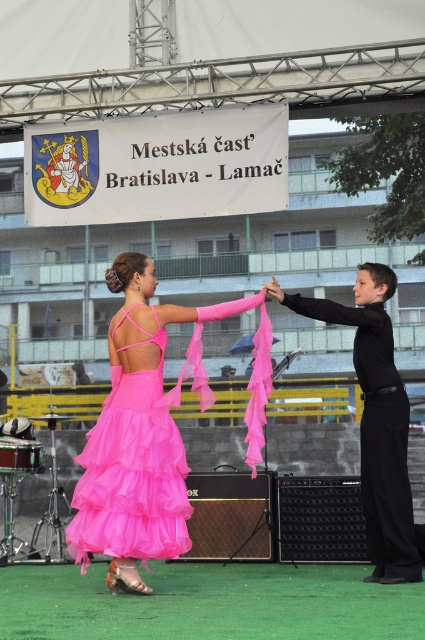
Question: Is matte pink tulle dress at center positioned before black smooth pants at right?

Choices:
 (A) no
 (B) yes

Answer: (B)

Question: Among these objects, which one is nearest to the camera?

Choices:
 (A) black smooth pants at right
 (B) matte pink tulle dress at center

Answer: (B)

Question: In this image, where is matte pink tulle dress at center located relative to black smooth pants at right?

Choices:
 (A) above
 (B) below

Answer: (A)

Question: Does matte pink tulle dress at center appear under black smooth pants at right?

Choices:
 (A) yes
 (B) no

Answer: (B)

Question: Which object appears closest to the camera in this image?

Choices:
 (A) black smooth pants at right
 (B) matte pink tulle dress at center

Answer: (B)